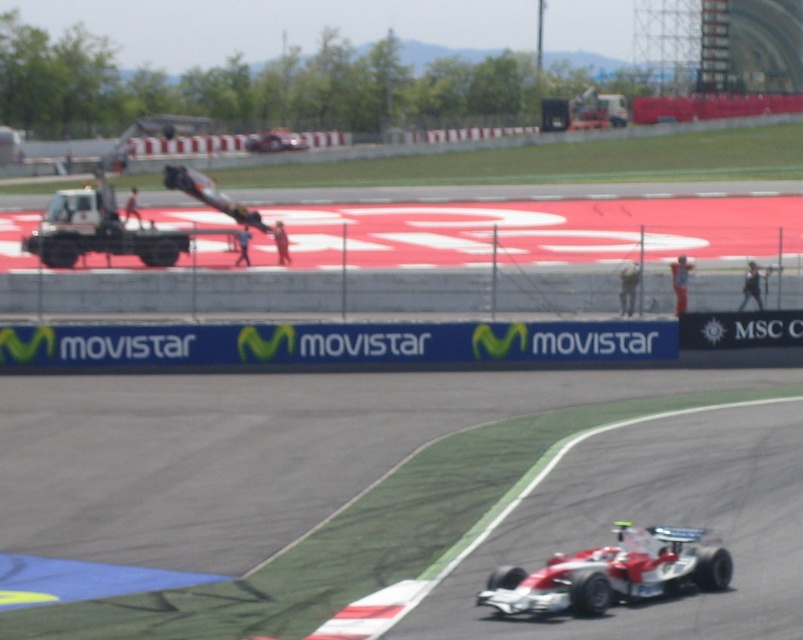
Question: Which point is closer to the camera taking this photo?

Choices:
 (A) (687, 566)
 (B) (104, 179)
 (C) (287, 134)

Answer: (A)

Question: Which object is closer to the camera taking this photo?

Choices:
 (A) white matte car at center
 (B) white glossy race car at lower right
 (C) white matte tow truck at left

Answer: (B)

Question: Does white glossy race car at lower right come behind white matte tow truck at left?

Choices:
 (A) no
 (B) yes

Answer: (A)

Question: Observing the image, what is the correct spatial positioning of white glossy race car at lower right in reference to white matte car at center?

Choices:
 (A) right
 (B) left

Answer: (A)

Question: Which object is closer to the camera taking this photo?

Choices:
 (A) white matte tow truck at left
 (B) white glossy race car at lower right
 (C) white matte car at center

Answer: (B)

Question: Is white glossy race car at lower right below white matte tow truck at left?

Choices:
 (A) yes
 (B) no

Answer: (A)